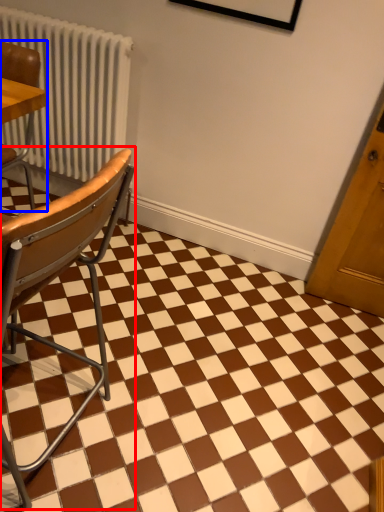
Question: Which point is further to the camera, chair (highlighted by a red box) or chair (highlighted by a blue box)?

Choices:
 (A) chair
 (B) chair

Answer: (B)